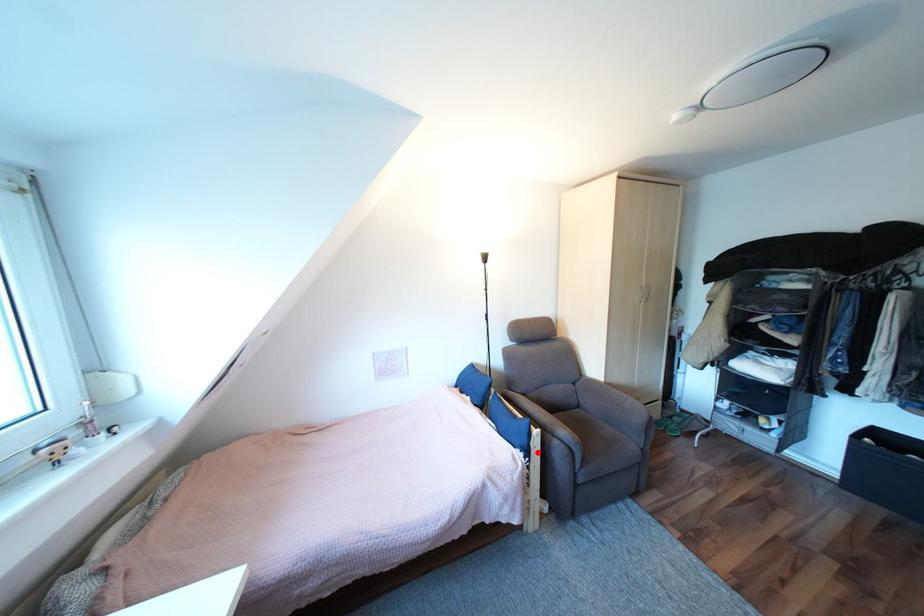
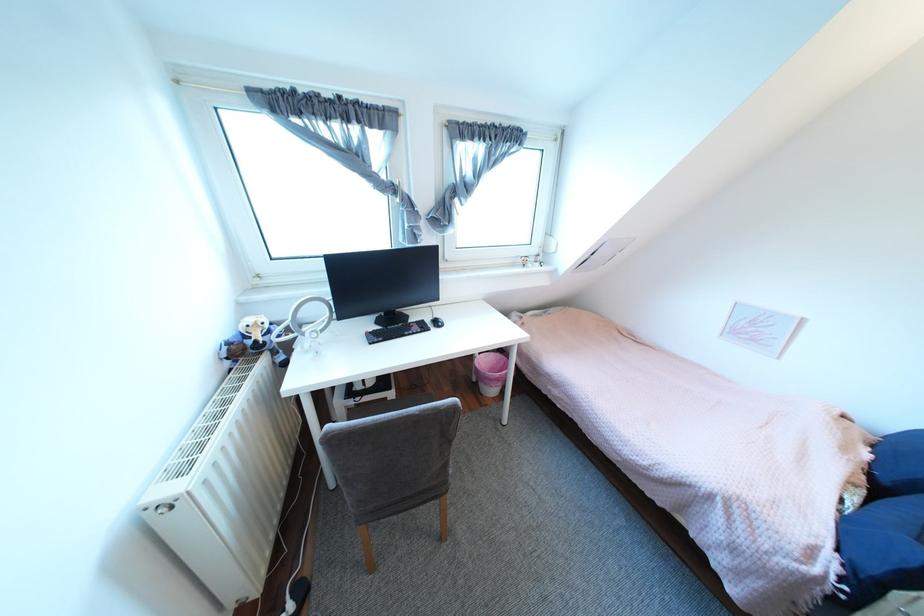
Question: I am providing you with two images of the same scene from different viewpoints. Image1 has a red point marked. In image2, the corresponding 3D location appears at what relative position? Reply with the corresponding letter.

Choices:
 (A) Closer
 (B) Farther

Answer: (A)